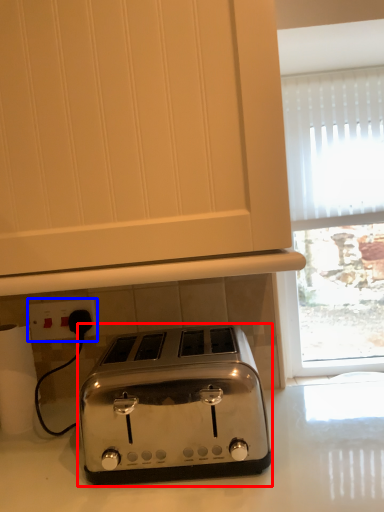
Question: Which object is closer to the camera taking this photo, toaster (highlighted by a red box) or electric outlet (highlighted by a blue box)?

Choices:
 (A) toaster
 (B) electric outlet

Answer: (A)